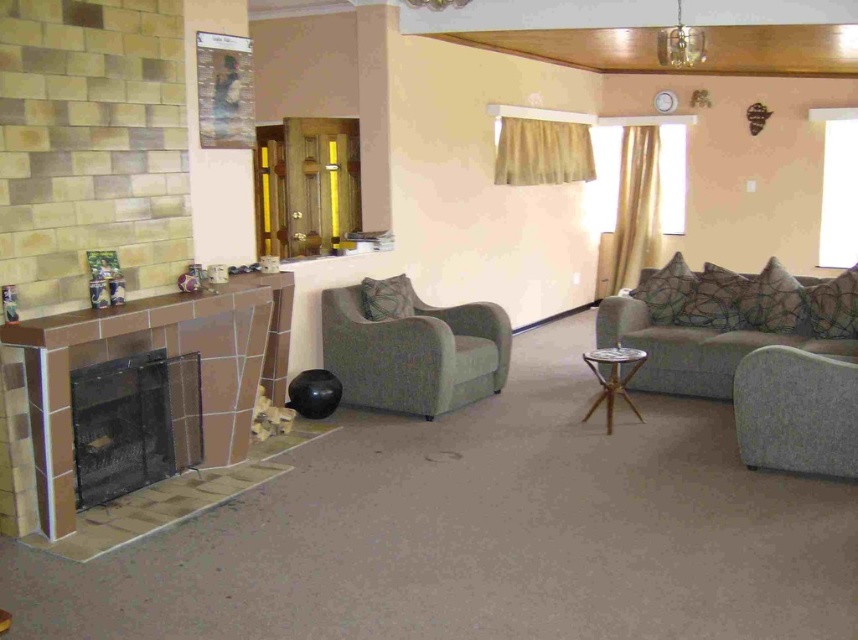
You are planning to rearrange the living room furniture. If you want to place the textured gray armchair at lower right closer to the black mesh fireplace at lower left, which object would require more space due to its size?

The black mesh fireplace at lower left requires more space because it is larger in size than the textured gray armchair at lower right.

You are sitting on the sofa and want to move to the door. You see the brown tile fireplace at left and the matte green fabric armchair at center. Which object is closer to the door?

The brown tile fireplace at left is positioned on the left side of matte green fabric armchair at center, so the armchair is closer to the door than the fireplace.